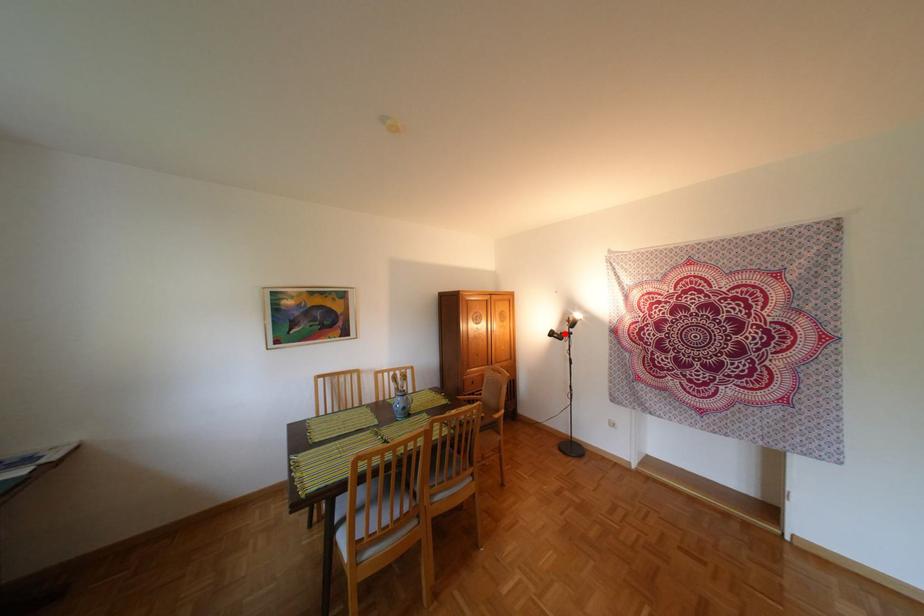
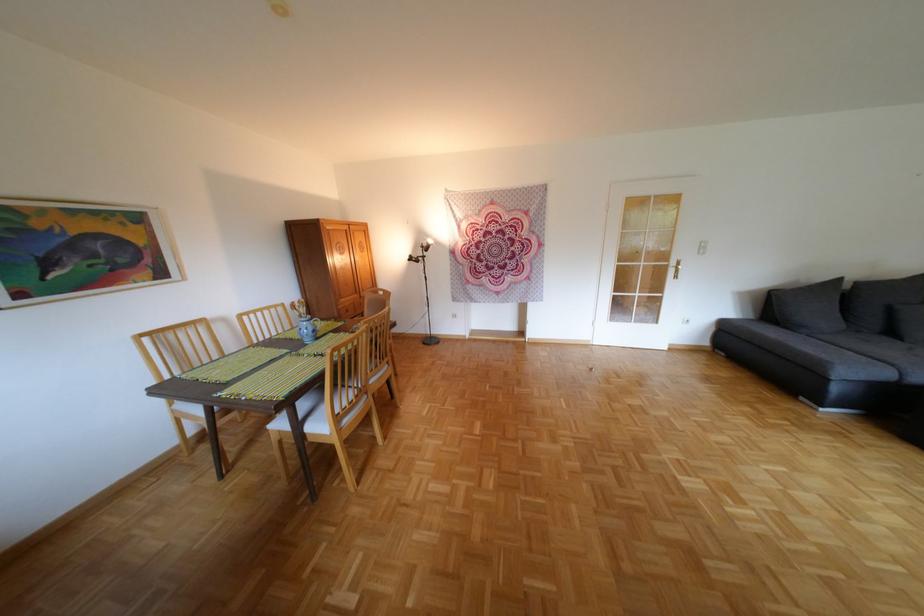
Where in the second image is the point corresponding to the highlighted location from the first image?

(423, 257)